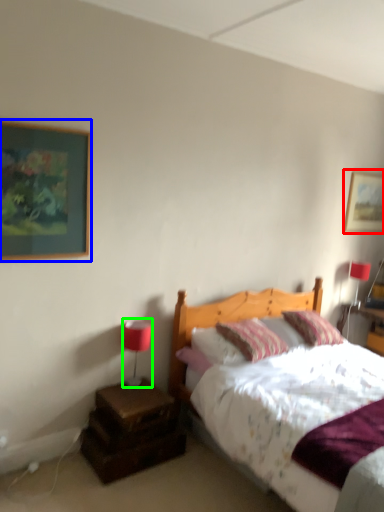
Question: Estimate the real-world distances between objects in this image. Which object is farther from picture frame (highlighted by a red box), picture frame (highlighted by a blue box) or table lamp (highlighted by a green box)?

Choices:
 (A) picture frame
 (B) table lamp

Answer: (A)